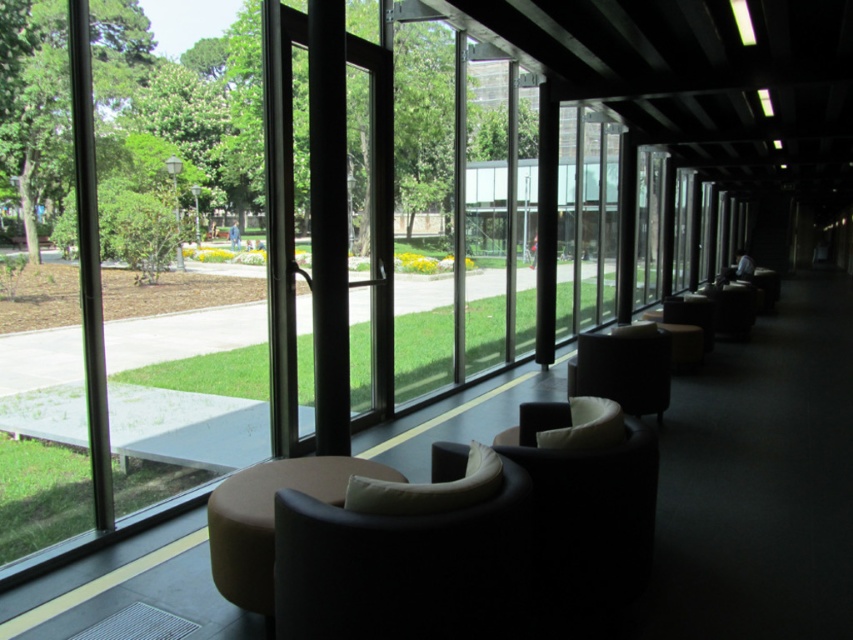
Question: Which point appears closest to the camera in this image?

Choices:
 (A) (654, 378)
 (B) (503, 502)

Answer: (B)

Question: Is matte black armchair at center to the left of matte black chair at center from the viewer's perspective?

Choices:
 (A) no
 (B) yes

Answer: (B)

Question: Is matte black armchair at center positioned behind matte black chair at center?

Choices:
 (A) yes
 (B) no

Answer: (B)

Question: Does matte black armchair at center appear on the left side of matte black chair at center?

Choices:
 (A) no
 (B) yes

Answer: (B)